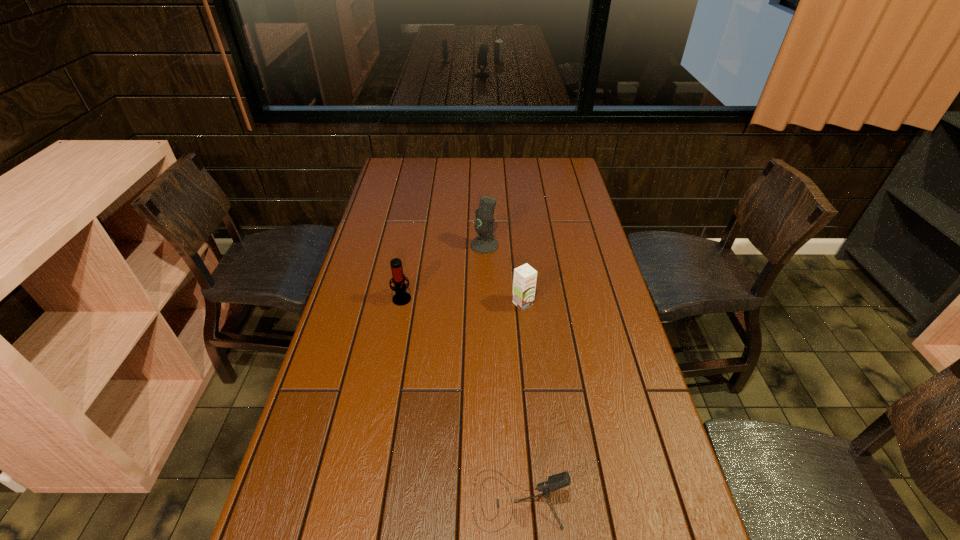
At what (x,y) coordinates should I click in order to perform the action: click on vacant space located 0.120m on the stand of the nearest object. Please return your answer as a coordinate pair (x, y). Looking at the image, I should click on (416, 500).

Find the location of a particular element. The image size is (960, 540). free space located 0.370m on the stand of the nearest object is located at coordinates (294, 500).

Identify the location of vacant space located 0.100m on the stand of the nearest object. Image resolution: width=960 pixels, height=540 pixels. (425, 500).

At what (x,y) coordinates should I click in order to perform the action: click on object located at the left edge. Please return your answer as a coordinate pair (x, y). The height and width of the screenshot is (540, 960). Looking at the image, I should click on (401, 298).

In the image, there is a desktop. Identify the location of vacant space at the far edge. Image resolution: width=960 pixels, height=540 pixels. (523, 179).

I want to click on vacant space at the left edge, so click(x=308, y=417).

Find the location of a particular element. free region at the right edge of the desktop is located at coordinates (575, 249).

The image size is (960, 540). I want to click on vacant region at the far right corner, so click(x=568, y=166).

At what (x,y) coordinates should I click in order to perform the action: click on vacant region between the second tallest microphone and the chocolate milk. Please return your answer as a coordinate pair (x, y). The width and height of the screenshot is (960, 540). Looking at the image, I should click on (463, 301).

Locate an element on the screen. The image size is (960, 540). empty location between the nearest microphone and the second nearest microphone is located at coordinates (460, 399).